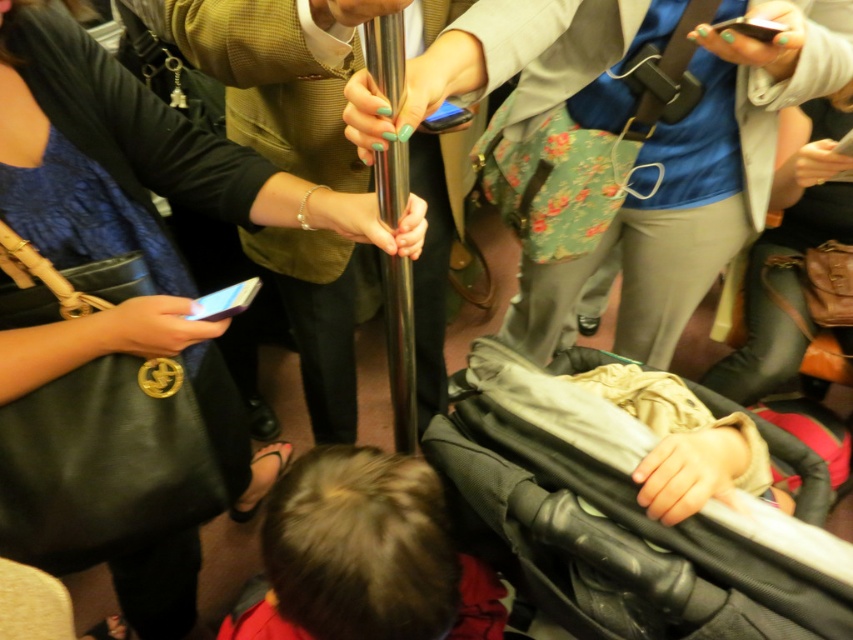
Is point (48, 528) positioned in front of point (502, 4)?

No, it is behind (502, 4).

Is matte black handbag at upper left to the right of floral fabric backpack at center from the viewer's perspective?

Incorrect, matte black handbag at upper left is not on the right side of floral fabric backpack at center.

The height and width of the screenshot is (640, 853). What do you see at coordinates (125, 320) in the screenshot?
I see `matte black handbag at upper left` at bounding box center [125, 320].

Where is `matte black handbag at upper left`? The width and height of the screenshot is (853, 640). matte black handbag at upper left is located at coordinates (125, 320).